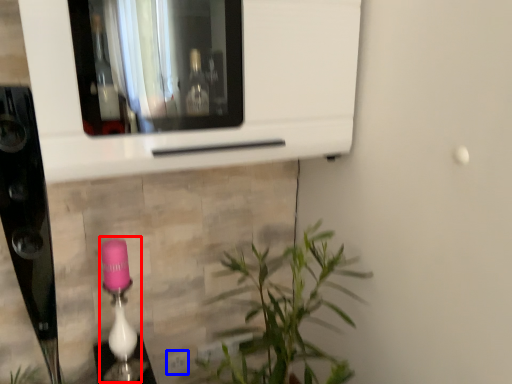
Question: Among these objects, which one is farthest to the camera, lamp (highlighted by a red box) or electric outlet (highlighted by a blue box)?

Choices:
 (A) lamp
 (B) electric outlet

Answer: (B)